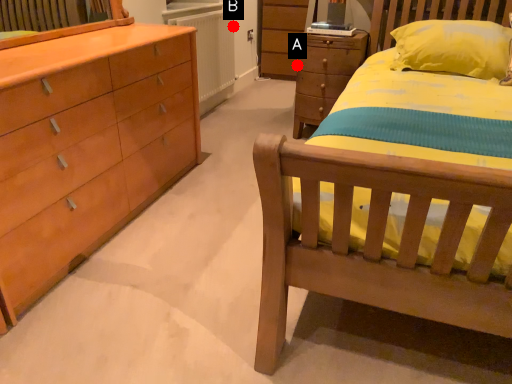
Question: Two points are circled on the image, labeled by A and B beside each circle. Which of the following is the closest to the observer?

Choices:
 (A) A is closer
 (B) B is closer

Answer: (B)